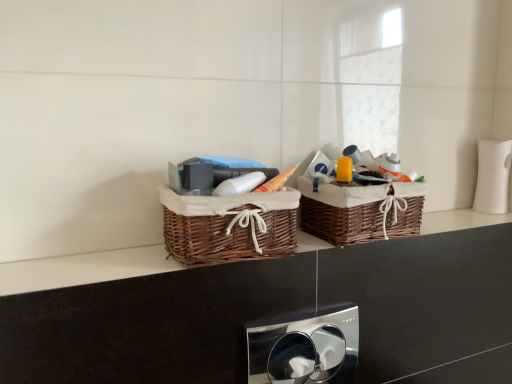
Locate an element on the screen. free space above woven brown basket at center, which appears as the 2th picnic basket when viewed from the right (from a real-world perspective) is located at coordinates (236, 189).